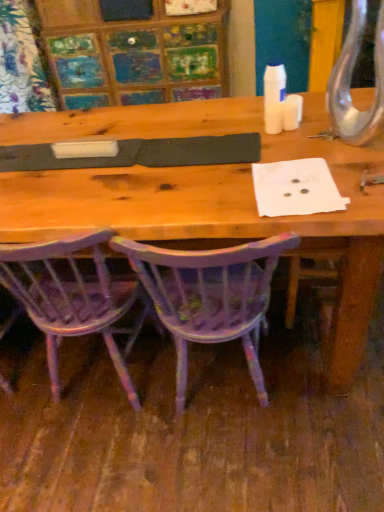
Question: From their relative heights in the image, would you say purple painted wood chair at lower center, marked as the 2th chair in a right-to-left arrangement, is taller or shorter than purple painted wood chair at center, arranged as the 1th chair when viewed from the right?

Choices:
 (A) short
 (B) tall

Answer: (B)

Question: Considering the positions of purple painted wood chair at lower center, marked as the 2th chair in a right-to-left arrangement, and purple painted wood chair at center, arranged as the 1th chair when viewed from the right, in the image, is purple painted wood chair at lower center, marked as the 2th chair in a right-to-left arrangement, wider or thinner than purple painted wood chair at center, arranged as the 1th chair when viewed from the right,?

Choices:
 (A) thin
 (B) wide

Answer: (A)

Question: From a real-world perspective, is purple painted wood chair at lower center, acting as the first chair starting from the left, above or below purple painted wood chair at center, which is the 2th chair in left-to-right order?

Choices:
 (A) above
 (B) below

Answer: (A)

Question: From their relative heights in the image, would you say purple painted wood chair at center, arranged as the 1th chair when viewed from the right, is taller or shorter than purple painted wood chair at lower center, acting as the first chair starting from the left?

Choices:
 (A) short
 (B) tall

Answer: (A)

Question: Considering the positions of point (109, 245) and point (148, 309), is point (109, 245) closer or farther from the camera than point (148, 309)?

Choices:
 (A) farther
 (B) closer

Answer: (B)

Question: Based on their positions, is purple painted wood chair at center, which is the 2th chair in left-to-right order, located to the left or right of purple painted wood chair at lower center, acting as the first chair starting from the left?

Choices:
 (A) right
 (B) left

Answer: (A)

Question: Is purple painted wood chair at center, which is the 2th chair in left-to-right order, in front of or behind purple painted wood chair at lower center, marked as the 2th chair in a right-to-left arrangement, in the image?

Choices:
 (A) front
 (B) behind

Answer: (A)